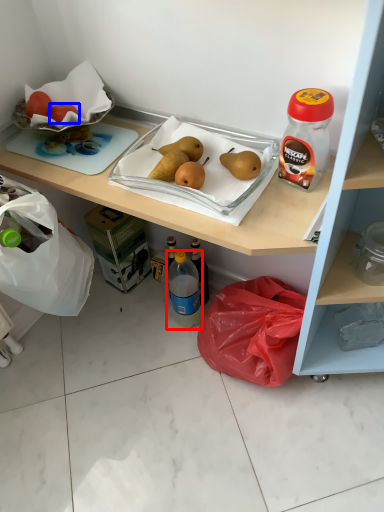
Question: Which point is further to the camera, bottle (highlighted by a red box) or fruit (highlighted by a blue box)?

Choices:
 (A) bottle
 (B) fruit

Answer: (A)